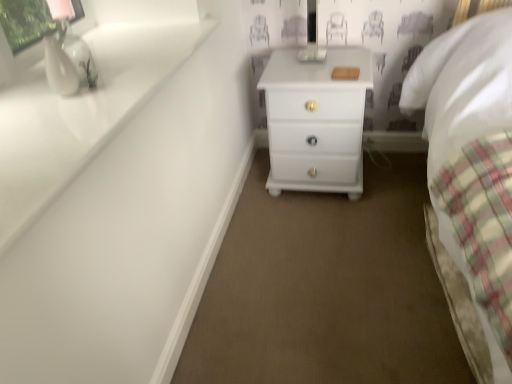
You are a GUI agent. You are given a task and a screenshot of the screen. Output one action in this format:
    pyautogui.click(x=<x>, y=<y>)
    Task: Click on the blank space above white glossy chest of drawers at center (from a real-world perspective)
    The image size is (512, 384).
    Given the screenshot: What is the action you would take?
    pyautogui.click(x=311, y=61)